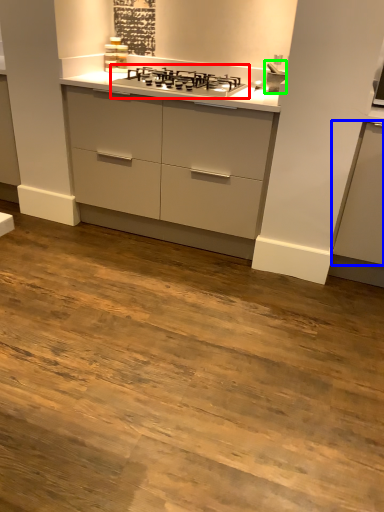
Question: Based on their relative distances, which object is nearer to gas stove (highlighted by a red box)? Choose from cabinetry (highlighted by a blue box) and sink (highlighted by a green box).

Choices:
 (A) cabinetry
 (B) sink

Answer: (B)